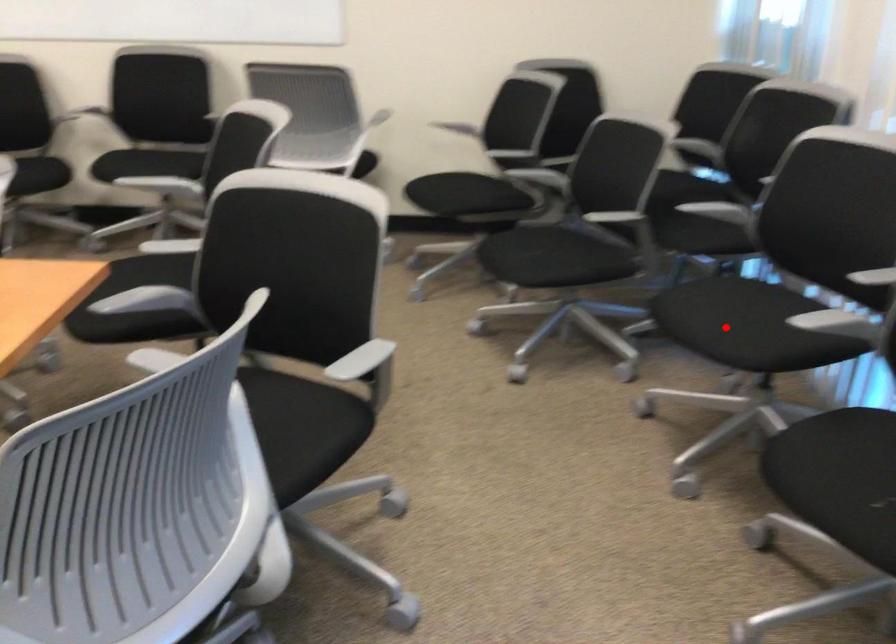
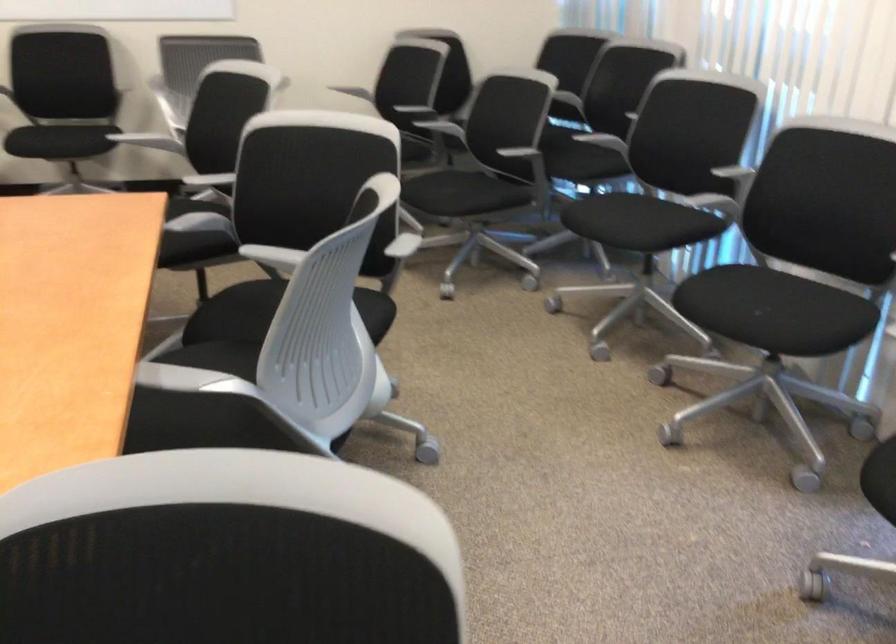
Question: I am providing you with two images of the same scene from different viewpoints. Given a red point in image1, look at the same physical point in image2. Is it:

Choices:
 (A) Closer to the viewpoint
 (B) Farther from the viewpoint

Answer: (B)